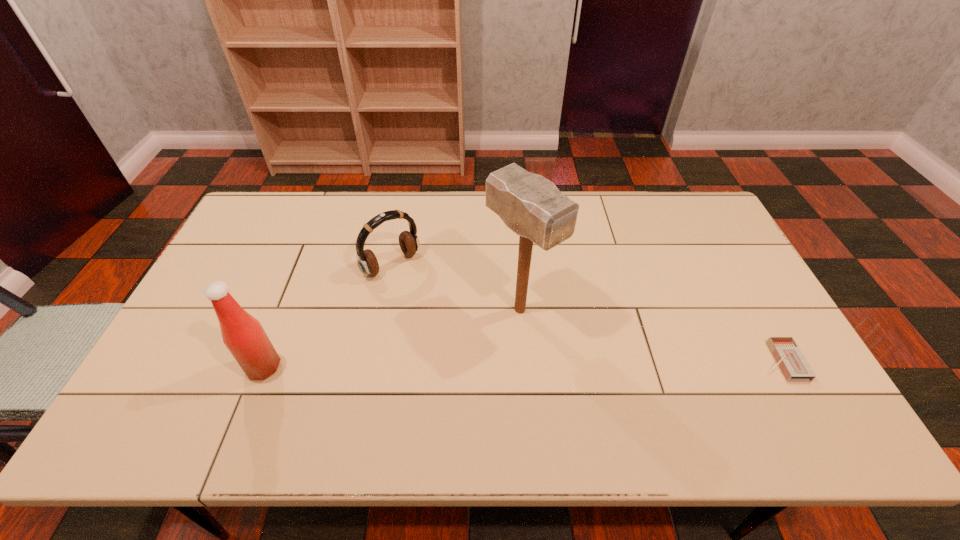
I want to click on blank area located 0.130m on the front-facing side of the condiment, so click(195, 367).

The height and width of the screenshot is (540, 960). Identify the location of vacant space located 0.340m on the striking surface of the rightmost object. (627, 361).

This screenshot has width=960, height=540. I want to click on free region located on the striking surface of the rightmost object, so click(670, 361).

Find the location of a particular element. vacant space located on the striking surface of the rightmost object is located at coordinates (608, 361).

Where is `free point located 0.150m on the ear cup of the second shortest object`? Image resolution: width=960 pixels, height=540 pixels. free point located 0.150m on the ear cup of the second shortest object is located at coordinates (436, 308).

This screenshot has width=960, height=540. Identify the location of vacant space located on the ear cup of the second shortest object. (460, 333).

The height and width of the screenshot is (540, 960). What are the coordinates of `blank space located 0.070m on the ear cup of the second shortest object` in the screenshot? It's located at (420, 292).

At what (x,y) coordinates should I click in order to perform the action: click on vacant region located above the head of the mallet. Please return your answer as a coordinate pair (x, y). The height and width of the screenshot is (540, 960). Looking at the image, I should click on (592, 377).

Identify the location of free space located above the head of the mallet. (614, 397).

Find the location of a particular element. vacant space positioned 0.140m above the head of the mallet is located at coordinates (583, 369).